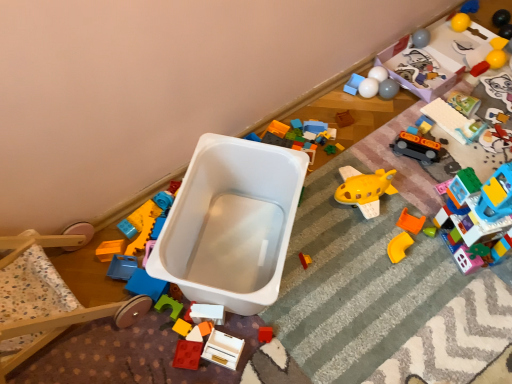
Locate an element on the screen. This screenshot has height=384, width=512. vacant area that lies between rubberized red brick at lower center, positioned as the fifteenth toy in right-to-left order, and orange plastic train at center, which ranks as the sixth toy in right-to-left order is located at coordinates (326, 235).